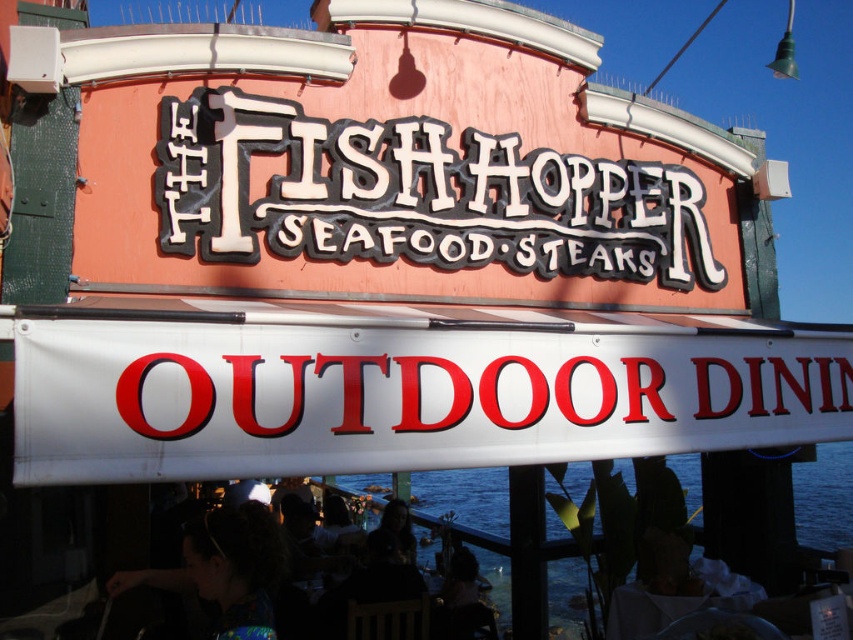
You are standing at the entrance of The Fishhopper restaurant and want to take a photo of both the point at coordinates point (x=234, y=88) and point (x=778, y=384) in the frame. Which point should you focus on first to ensure both are in focus?

You should focus on point (x=234, y=88) first because it is closer to the camera than point (x=778, y=384). By focusing on the closer point, the farther point will also be in focus due to the depth of field.

You are a customer approaching the restaurant and notice the white glossy signboard at center and the transparent water at lower center. Which object is located above the other?

The white glossy signboard at center is positioned over transparent water at lower center, so it is located above the transparent water at lower center.

You are a customer approaching the restaurant and see the white plastic sign at lower center and the black plastic sign at center. Which sign is shorter?

The white plastic sign at lower center is shorter than the black plastic sign at center.